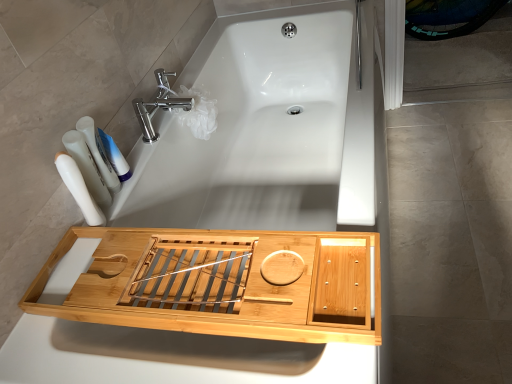
How much space does white plastic bottles at left, which ranks as the 1th toiletry in front-to-back order, occupy horizontally?

white plastic bottles at left, which ranks as the 1th toiletry in front-to-back order, is 2.52 inches in width.

The image size is (512, 384). Describe the element at coordinates (99, 153) in the screenshot. I see `white plastic bottles at left, marked as the third toiletry in a front-to-back arrangement` at that location.

What do you see at coordinates (113, 155) in the screenshot? The height and width of the screenshot is (384, 512). I see `white matte toothpaste at upper left` at bounding box center [113, 155].

The height and width of the screenshot is (384, 512). I want to click on natural wood bath tray at center, so click(x=186, y=315).

Is polished chrome faucet at upper center aimed at natural wood tray at center?

No, polished chrome faucet at upper center does not turn towards natural wood tray at center.

Are polished chrome faucet at upper center and natural wood tray at center making contact?

No, polished chrome faucet at upper center is not with natural wood tray at center.

At what (x,y) coordinates should I click in order to perform the action: click on tap on the left of natural wood tray at center. Please return your answer as a coordinate pair (x, y). The image size is (512, 384). Looking at the image, I should click on (159, 104).

Which point is more distant from viewer, [145,113] or [117,257]?

Positioned behind is point [145,113].

Can you confirm if white plastic toothbrushes at left, which appears as the second toiletry when viewed from the back, is bigger than natural wood bath tray at center?

Actually, white plastic toothbrushes at left, which appears as the second toiletry when viewed from the back, might be smaller than natural wood bath tray at center.

Which object is further away from the camera, white plastic toothbrushes at left, which appears as the second toiletry when viewed from the back, or natural wood bath tray at center?

white plastic toothbrushes at left, which appears as the second toiletry when viewed from the back, is behind.

From a real-world perspective, which object stands above the other?

white plastic toothbrushes at left, which is counted as the second toiletry, starting from the front.

Which of these two, white plastic toothbrushes at left, which appears as the second toiletry when viewed from the back, or natural wood bath tray at center, is thinner?

white plastic toothbrushes at left, which appears as the second toiletry when viewed from the back, is thinner.

Relative to polished chrome faucet at upper center, is natural wood tray at center in front or behind?

Clearly, natural wood tray at center is in front of polished chrome faucet at upper center.

Which point is more distant from viewer, (32, 297) or (163, 73)?

Point (163, 73)

How different are the orientations of natural wood tray at center and polished chrome faucet at upper center in degrees?

The angular difference between natural wood tray at center and polished chrome faucet at upper center is 90.5 degrees.

Is the depth of natural wood bath tray at center less than that of white plastic bottles at left, which ranks as the 1th toiletry in front-to-back order?

That is True.

Between natural wood bath tray at center and white plastic bottles at left, which appears as the 3th toiletry when viewed from the back, which one appears on the right side from the viewer's perspective?

Positioned to the right is natural wood bath tray at center.

Can you tell me how much natural wood bath tray at center and white plastic bottles at left, which appears as the 3th toiletry when viewed from the back, differ in facing direction?

48.7 degrees.

Looking at this image, from a real-world perspective, which is physically above, natural wood bath tray at center or white plastic bottles at left, which ranks as the 1th toiletry in front-to-back order?

In real-world perspective, white plastic bottles at left, which ranks as the 1th toiletry in front-to-back order, is above.

At what (x,y) coordinates should I click in order to perform the action: click on the 3rd toiletry counting from the left side of the natural wood tray at center. Please return your answer as a coordinate pair (x, y). Looking at the image, I should click on (87, 167).

Between white plastic toothbrushes at left, which appears as the second toiletry when viewed from the back, and natural wood tray at center, which one has larger size?

With larger size is natural wood tray at center.

Considering their positions, is white plastic toothbrushes at left, which appears as the second toiletry when viewed from the back, located in front of or behind natural wood tray at center?

Visually, white plastic toothbrushes at left, which appears as the second toiletry when viewed from the back, is located behind natural wood tray at center.

How distant is white plastic toothbrushes at left, which appears as the second toiletry when viewed from the back, from natural wood tray at center?

white plastic toothbrushes at left, which appears as the second toiletry when viewed from the back, is 13.96 inches from natural wood tray at center.

From a real-world perspective, who is located lower, natural wood tray at center or white plastic bottles at left, marked as the third toiletry in a front-to-back arrangement?

natural wood tray at center, from a real-world perspective.

Does natural wood tray at center have a lesser width compared to white plastic bottles at left, marked as the third toiletry in a front-to-back arrangement?

No.

Considering the relative sizes of natural wood tray at center and white plastic bottles at left, marked as the third toiletry in a front-to-back arrangement, in the image provided, is natural wood tray at center taller than white plastic bottles at left, marked as the third toiletry in a front-to-back arrangement,?

In fact, natural wood tray at center may be shorter than white plastic bottles at left, marked as the third toiletry in a front-to-back arrangement.

Which point is more distant from viewer, (x=305, y=342) or (x=106, y=179)?

Positioned behind is point (x=106, y=179).

Is white plastic bottles at left, marked as the third toiletry in a front-to-back arrangement, taller or shorter than white plastic bottles at left, which ranks as the 1th toiletry in front-to-back order?

white plastic bottles at left, marked as the third toiletry in a front-to-back arrangement, is shorter than white plastic bottles at left, which ranks as the 1th toiletry in front-to-back order.

Is white plastic bottles at left, marked as the third toiletry in a front-to-back arrangement, inside or outside of white plastic bottles at left, which ranks as the 1th toiletry in front-to-back order?

white plastic bottles at left, marked as the third toiletry in a front-to-back arrangement, is not inside white plastic bottles at left, which ranks as the 1th toiletry in front-to-back order, it's outside.

Between white plastic bottles at left, marked as the third toiletry in a front-to-back arrangement, and white plastic bottles at left, which ranks as the 1th toiletry in front-to-back order, which one has larger size?

With larger size is white plastic bottles at left, which ranks as the 1th toiletry in front-to-back order.

From the image's perspective, which one is positioned higher, white plastic bottles at left, marked as the third toiletry in a front-to-back arrangement, or white plastic bottles at left, which ranks as the 1th toiletry in front-to-back order?

From the image's view, white plastic bottles at left, marked as the third toiletry in a front-to-back arrangement, is above.

At what (x,y) coordinates should I click in order to perform the action: click on cabinetry to the right of polished chrome faucet at upper center. Please return your answer as a coordinate pair (x, y). Looking at the image, I should click on (212, 312).

Locate an element on the screen. The width and height of the screenshot is (512, 384). the 3rd toiletry counting from the left side of the natural wood bath tray at center is located at coordinates (87, 167).

Looking at this image, estimate the real-world distances between objects in this image. Which object is closer to white plastic bottles at left, which appears as the 3th toiletry when viewed from the back, natural wood tray at center or white plastic toothbrushes at left, which is counted as the second toiletry, starting from the front?

Among the two, white plastic toothbrushes at left, which is counted as the second toiletry, starting from the front, is located nearer to white plastic bottles at left, which appears as the 3th toiletry when viewed from the back.

Considering their positions, is natural wood bath tray at center positioned further to white plastic bottles at left, marked as the third toiletry in a front-to-back arrangement, than white plastic toothbrushes at left, which is counted as the second toiletry, starting from the front?

natural wood bath tray at center.

When comparing their distances from white plastic toothbrushes at left, which is counted as the second toiletry, starting from the front, does white plastic bottles at left, marked as the third toiletry in a front-to-back arrangement, or natural wood tray at center seem closer?

white plastic bottles at left, marked as the third toiletry in a front-to-back arrangement, lies closer to white plastic toothbrushes at left, which is counted as the second toiletry, starting from the front, than the other object.

Which object lies further to the anchor point white plastic bottles at left, which ranks as the 1th toiletry in front-to-back order, polished chrome faucet at upper center or natural wood bath tray at center?

natural wood bath tray at center lies further to white plastic bottles at left, which ranks as the 1th toiletry in front-to-back order, than the other object.

Which object lies nearer to the anchor point natural wood bath tray at center, white plastic toothbrushes at left, which appears as the second toiletry when viewed from the back, or white matte toothpaste at upper left?

Among the two, white plastic toothbrushes at left, which appears as the second toiletry when viewed from the back, is located nearer to natural wood bath tray at center.

Based on the photo, which object lies further to the anchor point white plastic toothbrushes at left, which appears as the second toiletry when viewed from the back, white plastic bottles at left, which appears as the 3th toiletry when viewed from the back, or natural wood tray at center?

Among the two, natural wood tray at center is located further to white plastic toothbrushes at left, which appears as the second toiletry when viewed from the back.

Based on the photo, from the image, which object appears to be nearer to white matte toothpaste at upper left, natural wood tray at center or natural wood bath tray at center?

Among the two, natural wood tray at center is located nearer to white matte toothpaste at upper left.

Based on their spatial positions, is white plastic toothbrushes at left, which is counted as the second toiletry, starting from the front, or white plastic bottles at left, marked as the third toiletry in a front-to-back arrangement, further from natural wood bath tray at center?

white plastic bottles at left, marked as the third toiletry in a front-to-back arrangement.

Where is `toothpaste between white plastic bottles at left, which appears as the 3th toiletry when viewed from the back, and polished chrome faucet at upper center, along the z-axis`? The width and height of the screenshot is (512, 384). toothpaste between white plastic bottles at left, which appears as the 3th toiletry when viewed from the back, and polished chrome faucet at upper center, along the z-axis is located at coordinates (113, 155).

This screenshot has width=512, height=384. What are the coordinates of `toothpaste between white plastic bottles at left, marked as the third toiletry in a front-to-back arrangement, and natural wood bath tray at center from left to right` in the screenshot? It's located at (113, 155).

Locate an element on the screen. The height and width of the screenshot is (384, 512). toothpaste situated between white plastic bottles at left, which appears as the 3th toiletry when viewed from the back, and natural wood bath tray at center from left to right is located at coordinates (113, 155).

Image resolution: width=512 pixels, height=384 pixels. In order to click on cabinetry between natural wood bath tray at center and white matte toothpaste at upper left from front to back in this screenshot , I will do `click(212, 312)`.